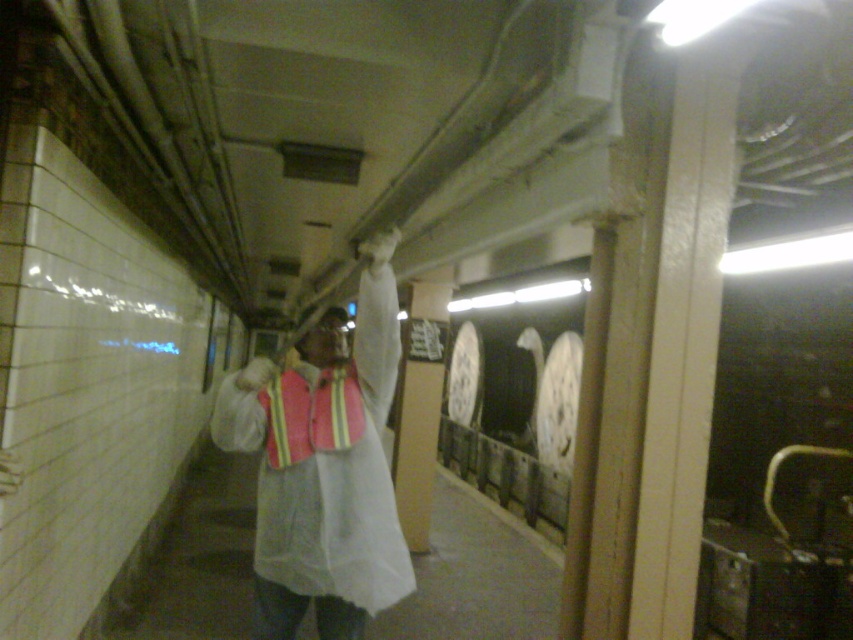
You are a maintenance worker in the subway station. You need to retrieve your safety vest which is at point (323, 472). Can you reach it while standing on the ground?

The reflective safety vest at center is located at point (323, 472). Since the worker is holding a long tool raised above their head, it is possible they can reach the safety vest at that point without needing a ladder.

You are standing at the entrance of the subway station and notice the reflective safety vest at center. Based on its position in the image, can you estimate its horizontal and vertical placement relative to the center of the image?

The reflective safety vest at center is located at point coordinates approximately 73.8 percent horizontally and 38.1 percent vertically from the bottom left corner of the image.

You are a passenger standing at the entrance of the subway station and see the reflective fabric safety vest at center and the matte white head at center. Which object is nearer to you?

The reflective fabric safety vest at center is closer to the viewer than the matte white head at center.